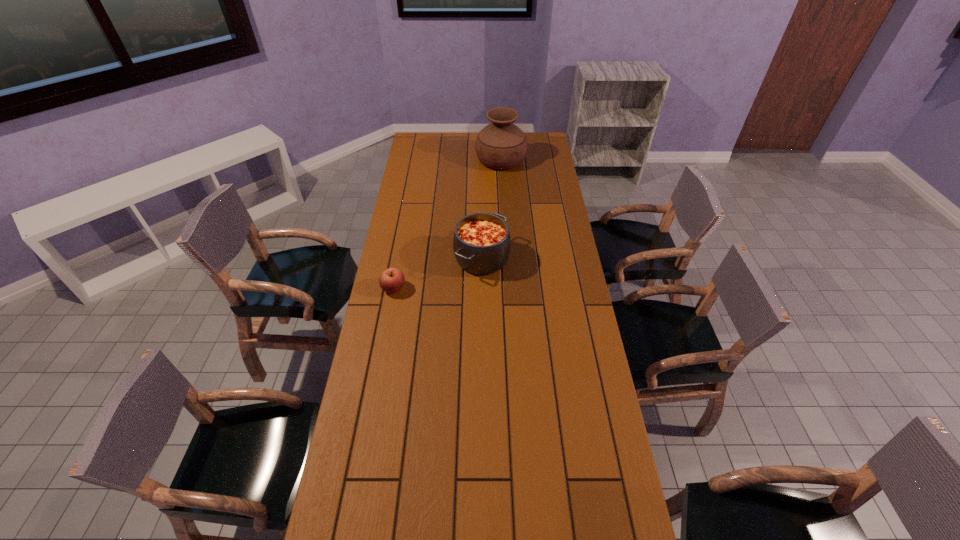
At what (x,y) coordinates should I click in order to perform the action: click on object located at the right edge. Please return your answer as a coordinate pair (x, y). The image size is (960, 540). Looking at the image, I should click on (501, 145).

Identify the location of object that is at the far right corner. Image resolution: width=960 pixels, height=540 pixels. (501, 145).

At what (x,y) coordinates should I click in order to perform the action: click on vacant space at the left edge of the desktop. Please return your answer as a coordinate pair (x, y). The width and height of the screenshot is (960, 540). Looking at the image, I should click on (394, 219).

The image size is (960, 540). In the image, there is a desktop. Find the location of `vacant space at the right edge`. vacant space at the right edge is located at coordinates (557, 217).

What are the coordinates of `vacant space at the far left corner of the desktop` in the screenshot? It's located at (437, 152).

The image size is (960, 540). Identify the location of free space between the apple and the farthest object. (447, 224).

The height and width of the screenshot is (540, 960). Find the location of `free point between the second shortest object and the leftmost object`. free point between the second shortest object and the leftmost object is located at coordinates (438, 273).

At what (x,y) coordinates should I click in order to perform the action: click on empty location between the urn and the casserole. Please return your answer as a coordinate pair (x, y). Looking at the image, I should click on (492, 209).

The height and width of the screenshot is (540, 960). Find the location of `unoccupied position between the leftmost object and the urn`. unoccupied position between the leftmost object and the urn is located at coordinates (447, 224).

I want to click on free space between the second tallest object and the farthest object, so click(x=492, y=209).